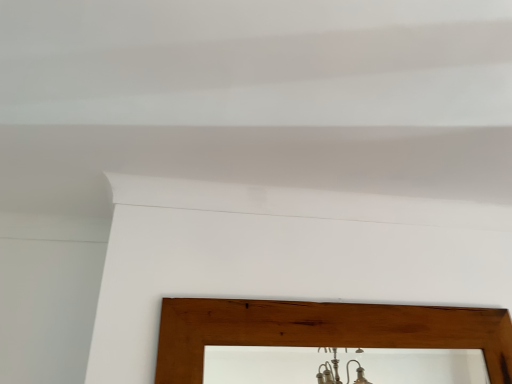
What do you see at coordinates (324, 330) in the screenshot? I see `brown wooden picture frame at lower center` at bounding box center [324, 330].

The width and height of the screenshot is (512, 384). What are the coordinates of `brown wooden picture frame at lower center` in the screenshot? It's located at (324, 330).

Identify the location of brown wooden picture frame at lower center. This screenshot has height=384, width=512. (324, 330).